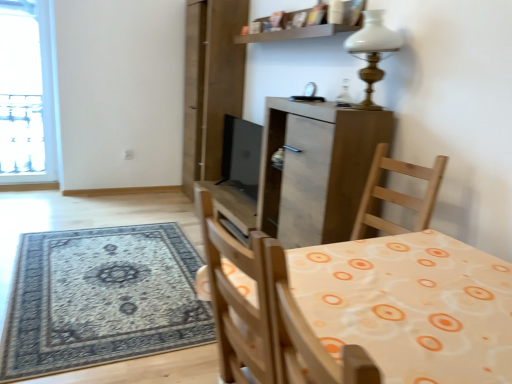
Question: Is matte wood cabinet at center not close to wooden table at center?

Choices:
 (A) no
 (B) yes

Answer: (A)

Question: Is matte wood cabinet at center aimed at wooden table at center?

Choices:
 (A) yes
 (B) no

Answer: (B)

Question: Considering the relative sizes of matte wood cabinet at center and wooden table at center in the image provided, is matte wood cabinet at center taller than wooden table at center?

Choices:
 (A) yes
 (B) no

Answer: (A)

Question: Is matte wood cabinet at center at the right side of wooden table at center?

Choices:
 (A) no
 (B) yes

Answer: (B)

Question: Does matte wood cabinet at center have a larger size compared to wooden table at center?

Choices:
 (A) yes
 (B) no

Answer: (A)

Question: Considering the relative sizes of matte wood cabinet at center and wooden table at center in the image provided, is matte wood cabinet at center wider than wooden table at center?

Choices:
 (A) no
 (B) yes

Answer: (A)

Question: Is matte wood cabinet at center far away from wooden shelf at upper center?

Choices:
 (A) yes
 (B) no

Answer: (B)

Question: Does matte wood cabinet at center come in front of wooden shelf at upper center?

Choices:
 (A) no
 (B) yes

Answer: (B)

Question: Does matte wood cabinet at center turn towards wooden shelf at upper center?

Choices:
 (A) yes
 (B) no

Answer: (B)

Question: Is matte wood cabinet at center bigger than wooden shelf at upper center?

Choices:
 (A) no
 (B) yes

Answer: (B)

Question: Is matte wood cabinet at center thinner than wooden shelf at upper center?

Choices:
 (A) yes
 (B) no

Answer: (B)

Question: From the image's perspective, is matte wood cabinet at center under wooden shelf at upper center?

Choices:
 (A) yes
 (B) no

Answer: (A)

Question: Is black matte screen door at upper center at the left side of wooden table at center?

Choices:
 (A) no
 (B) yes

Answer: (B)